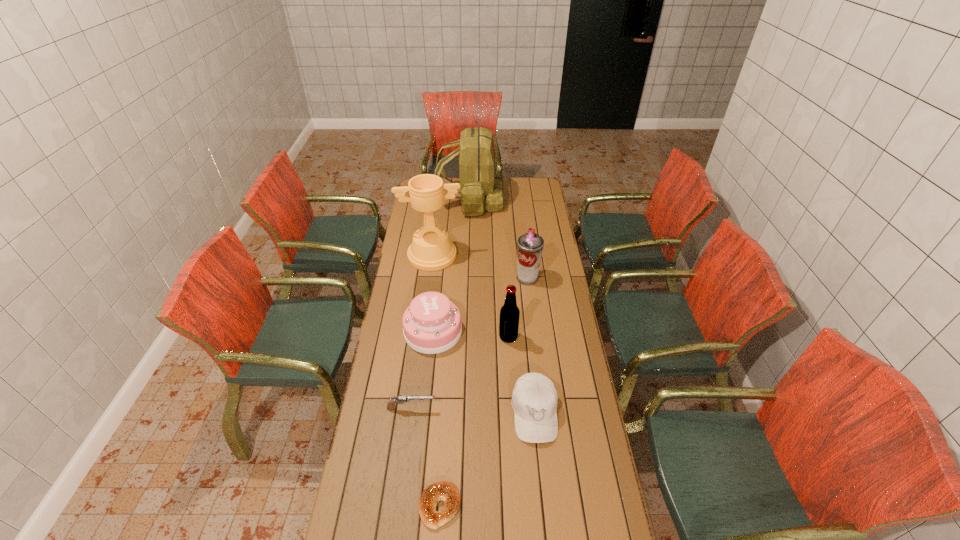
Where is `backpack`? Image resolution: width=960 pixels, height=540 pixels. backpack is located at coordinates (480, 187).

Find the location of `award`. award is located at coordinates (431, 250).

The image size is (960, 540). Identify the location of aerosol can. (530, 245).

Find the location of a particular element. beer bottle is located at coordinates (509, 313).

Identify the location of the fifth tallest object. (432, 324).

Find the location of `the third shortest object`. the third shortest object is located at coordinates (534, 400).

Find the location of a particular element. The height and width of the screenshot is (540, 960). gun is located at coordinates (401, 399).

Image resolution: width=960 pixels, height=540 pixels. Identify the location of the shortest object. (445, 491).

The height and width of the screenshot is (540, 960). Identify the location of the nearest object. (445, 491).

Where is `vacant area located 0.080m on the front-facing side of the backpack`? vacant area located 0.080m on the front-facing side of the backpack is located at coordinates (517, 201).